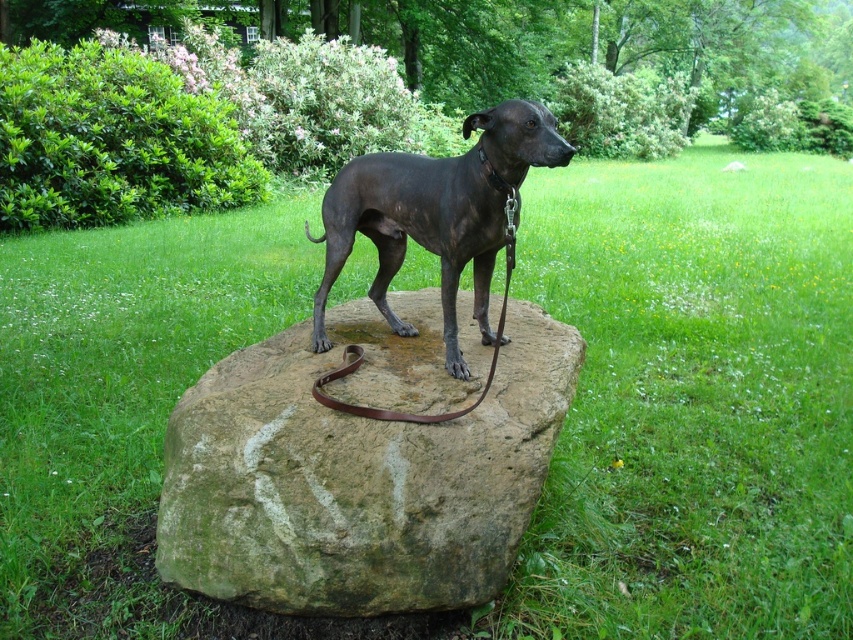
You are a photographer trying to capture the shiny black dog at center standing on the green mossy rock at center. Based on their sizes, do you think the rock is big enough to comfortably fit the dog?

The green mossy rock at center has a larger size compared to the shiny black dog at center, so the rock is big enough to comfortably fit the dog.

You are a photographer standing in the field, and you want to take a closeup photo of the shiny black dog at center. The camera you have can focus on objects within 2 meters. Will you be able to take the photo without moving closer?

The shiny black dog at center is 2.38 meters from the viewer. Since the camera can only focus on objects within 2 meters, you are 0.38 meters too far away to take a clear closeup photo without moving closer.

You are standing in the scene and want to walk from point (403,228) to point (370,413). Which direction should you move relative to your current position?

You should move away from yourself because point (403,228) is closer to you than point (370,413), so moving away will take you towards it.